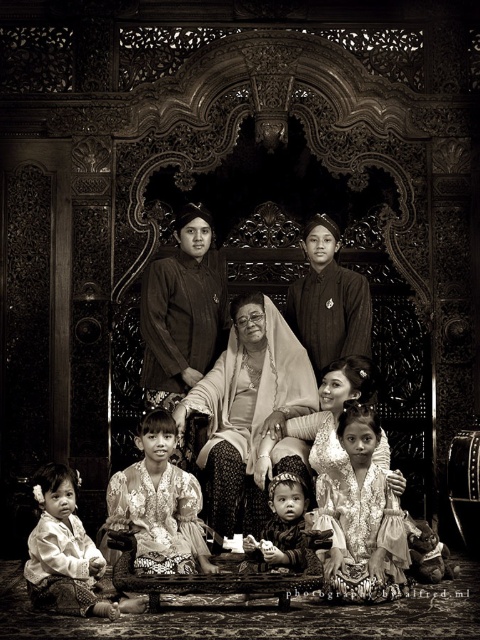
Who is more distant from viewer, (276,324) or (347,294)?

Positioned behind is point (347,294).

Does matte white shawl at center have a lesser width compared to smooth silk dress at center?

In fact, matte white shawl at center might be wider than smooth silk dress at center.

Is point (238, 396) closer to camera compared to point (364, 276)?

Yes, it is in front of point (364, 276).

You are a GUI agent. You are given a task and a screenshot of the screen. Output one action in this format:
    pyautogui.click(x=<x>, y=<y>)
    Task: Click on the matte white shawl at center
    
    Given the screenshot: What is the action you would take?
    pyautogui.click(x=250, y=410)

Who is positioned more to the left, matte white dress at lower left or smooth silk dress at center?

matte white dress at lower left

Is point (57, 464) in front of point (348, 308)?

No, it is not.

Between point (49, 525) and point (312, 300), which one is positioned in front?

Point (49, 525) is more forward.

Identify the location of matte white dress at lower left. (67, 554).

Which of these two, matte white shawl at center or silky white dress at center, stands taller?

matte white shawl at center

At what (x,y) coordinates should I click in order to perform the action: click on matte white shawl at center. Please return your answer as a coordinate pair (x, y). The width and height of the screenshot is (480, 640). Looking at the image, I should click on (250, 410).

The width and height of the screenshot is (480, 640). Identify the location of matte white shawl at center. (250, 410).